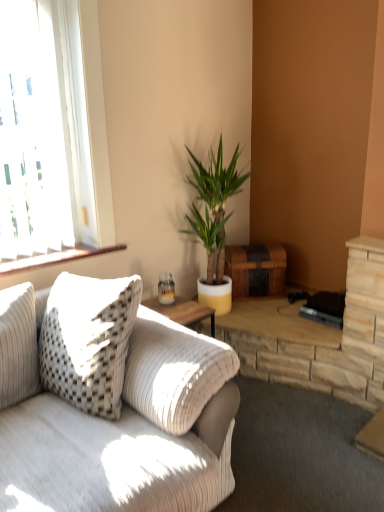
Question: Would you consider green leafy plant at center to be distant from white corduroy couch at left?

Choices:
 (A) yes
 (B) no

Answer: (A)

Question: Is green leafy plant at center shorter than white corduroy couch at left?

Choices:
 (A) yes
 (B) no

Answer: (B)

Question: Is green leafy plant at center to the left of white corduroy couch at left from the viewer's perspective?

Choices:
 (A) yes
 (B) no

Answer: (B)

Question: Is green leafy plant at center wider than white corduroy couch at left?

Choices:
 (A) no
 (B) yes

Answer: (A)

Question: Considering the relative sizes of green leafy plant at center and white corduroy couch at left in the image provided, is green leafy plant at center smaller than white corduroy couch at left?

Choices:
 (A) no
 (B) yes

Answer: (B)

Question: From the image's perspective, is green leafy plant at center above or below wooden at left?

Choices:
 (A) below
 (B) above

Answer: (B)

Question: Choose the correct answer: Is green leafy plant at center inside wooden at left or outside it?

Choices:
 (A) outside
 (B) inside

Answer: (A)

Question: Is green leafy plant at center taller or shorter than wooden at left?

Choices:
 (A) short
 (B) tall

Answer: (B)

Question: Considering their positions, is green leafy plant at center located in front of or behind wooden at left?

Choices:
 (A) behind
 (B) front

Answer: (A)

Question: Is point (240, 179) closer or farther from the camera than point (122, 325)?

Choices:
 (A) closer
 (B) farther

Answer: (B)

Question: Looking at their shapes, would you say green leafy plant at center is wider or thinner than white corduroy couch at left?

Choices:
 (A) thin
 (B) wide

Answer: (A)

Question: From a real-world perspective, is green leafy plant at center above or below white corduroy couch at left?

Choices:
 (A) above
 (B) below

Answer: (A)

Question: Is green leafy plant at center to the left or to the right of white corduroy couch at left in the image?

Choices:
 (A) left
 (B) right

Answer: (B)

Question: Is clear glass window at upper left taller or shorter than white corduroy couch at left?

Choices:
 (A) tall
 (B) short

Answer: (A)

Question: Is clear glass window at upper left in front of or behind white corduroy couch at left in the image?

Choices:
 (A) front
 (B) behind

Answer: (B)